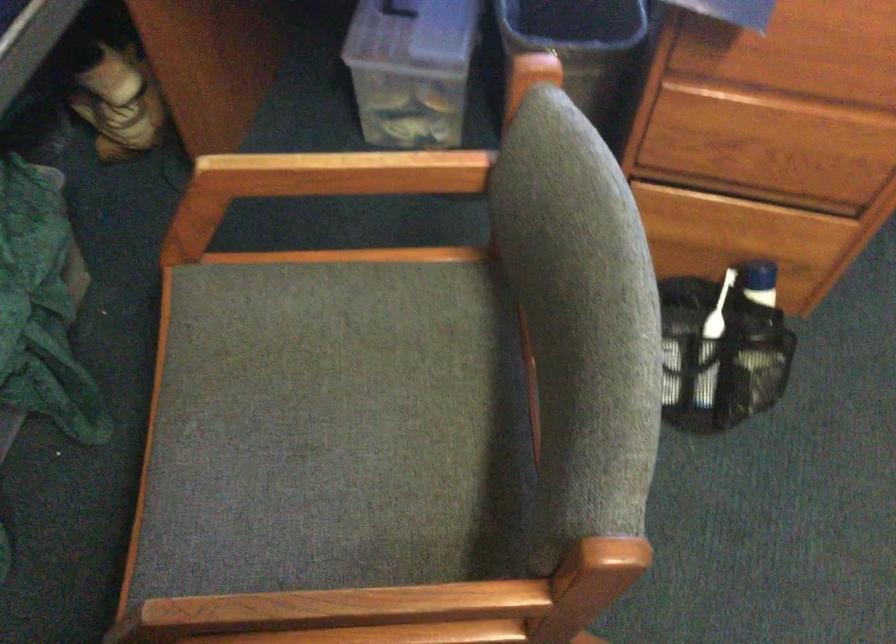
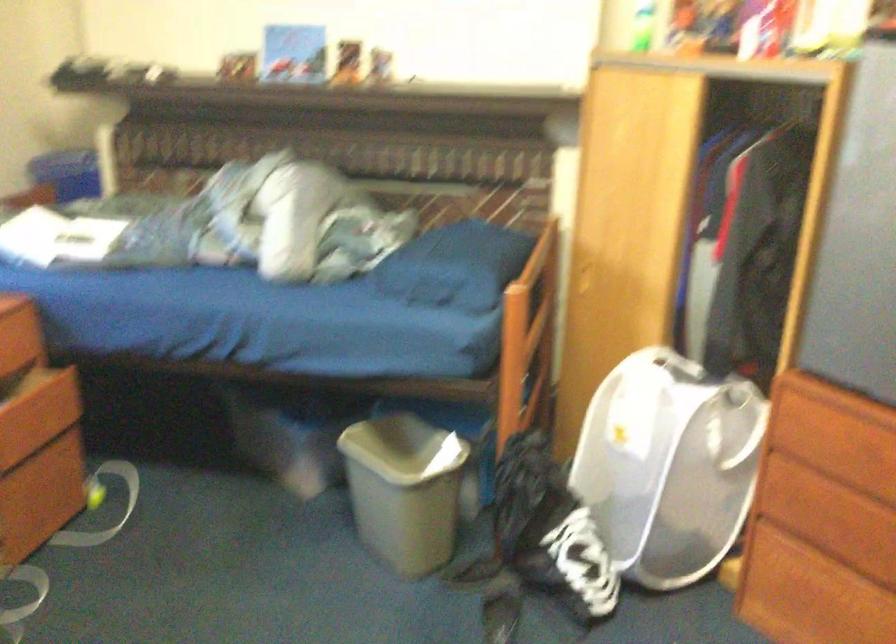
Question: The camera is either moving clockwise (left) or counter-clockwise (right) around the object. The first image is from the beginning of the video and the second image is from the end. Is the camera moving left or right when shooting the video?

Choices:
 (A) Left
 (B) Right

Answer: (A)